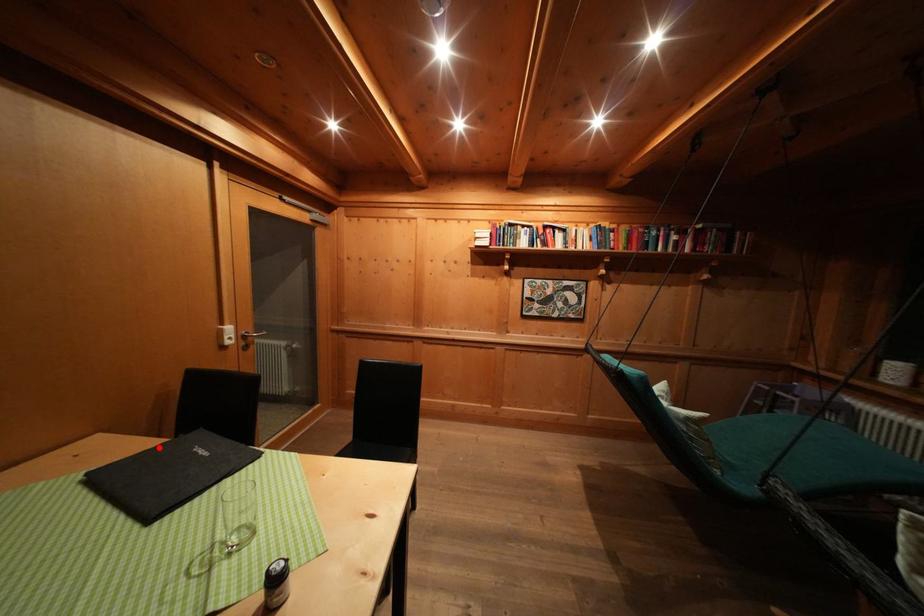
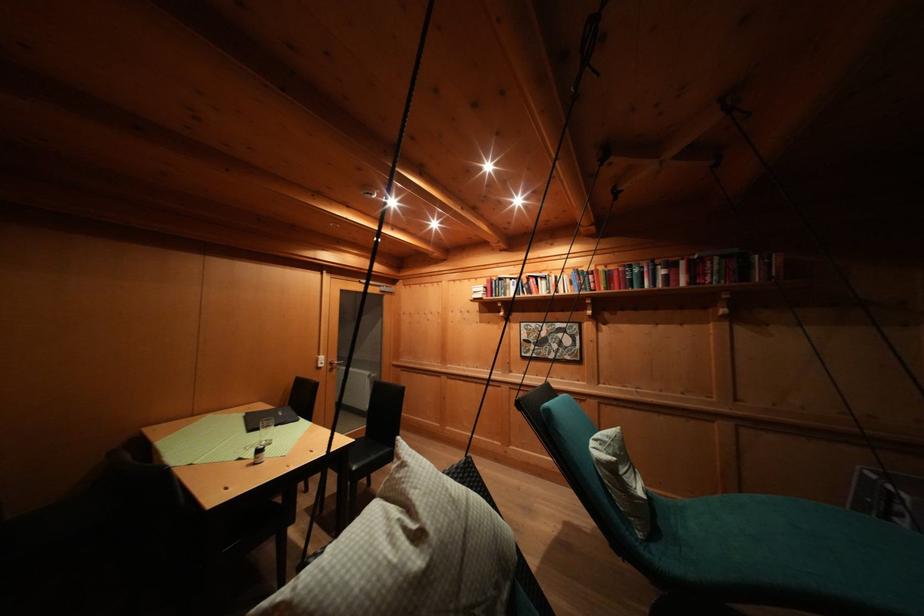
In the second image, find the point that corresponds to the highlighted location in the first image.

(275, 411)